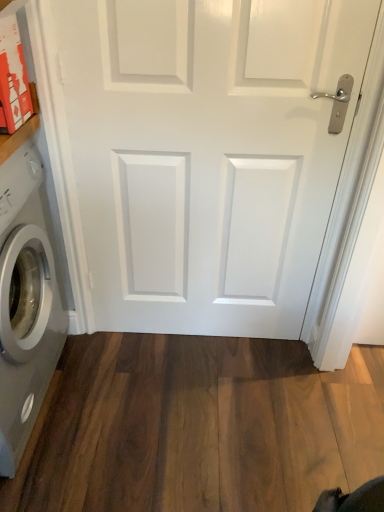
Question: Is white plastic washing machine at left facing towards brown wood flooring at lower center?

Choices:
 (A) no
 (B) yes

Answer: (B)

Question: Is white plastic washing machine at left directly adjacent to brown wood flooring at lower center?

Choices:
 (A) yes
 (B) no

Answer: (B)

Question: Considering the relative positions of white plastic washing machine at left and brown wood flooring at lower center in the image provided, is white plastic washing machine at left to the right of brown wood flooring at lower center from the viewer's perspective?

Choices:
 (A) no
 (B) yes

Answer: (A)

Question: Does white plastic washing machine at left contain brown wood flooring at lower center?

Choices:
 (A) yes
 (B) no

Answer: (B)

Question: From the image's perspective, does white plastic washing machine at left appear higher than brown wood flooring at lower center?

Choices:
 (A) yes
 (B) no

Answer: (A)

Question: Can you confirm if white plastic washing machine at left is wider than brown wood flooring at lower center?

Choices:
 (A) no
 (B) yes

Answer: (A)

Question: Is brown wood flooring at lower center aimed at white glossy door at center?

Choices:
 (A) no
 (B) yes

Answer: (A)

Question: Considering the relative positions of brown wood flooring at lower center and white glossy door at center in the image provided, is brown wood flooring at lower center to the left of white glossy door at center from the viewer's perspective?

Choices:
 (A) no
 (B) yes

Answer: (B)

Question: Does brown wood flooring at lower center have a lesser width compared to white glossy door at center?

Choices:
 (A) yes
 (B) no

Answer: (B)

Question: Is brown wood flooring at lower center not close to white glossy door at center?

Choices:
 (A) no
 (B) yes

Answer: (A)

Question: Is brown wood flooring at lower center facing away from white glossy door at center?

Choices:
 (A) yes
 (B) no

Answer: (B)

Question: Is brown wood flooring at lower center at the right side of white glossy door at center?

Choices:
 (A) yes
 (B) no

Answer: (B)

Question: Is white plastic washing machine at left oriented away from white glossy door at center?

Choices:
 (A) no
 (B) yes

Answer: (A)